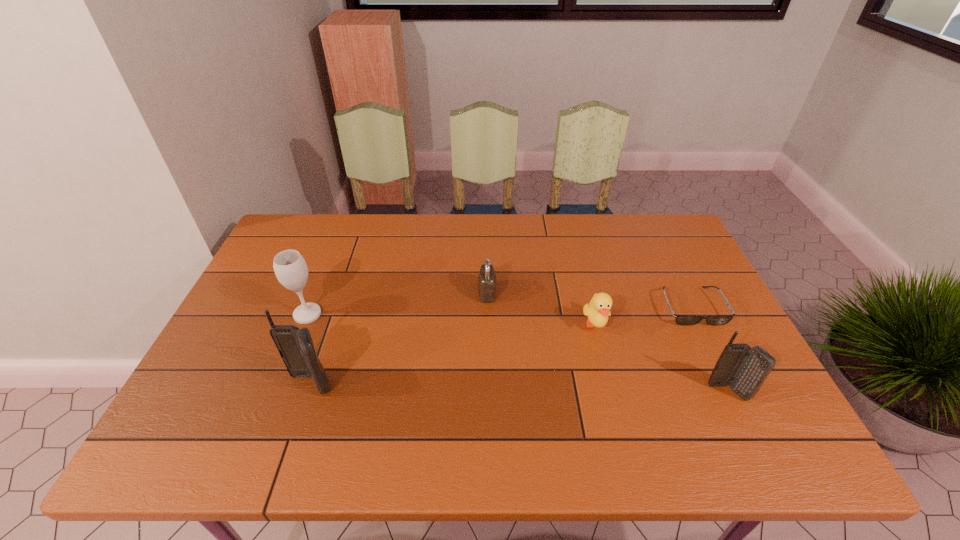
Locate an element on the screen. vacant space situated at the front of the padlock near the keyhole is located at coordinates (403, 293).

Where is `vacant space situated 0.090m on the front-facing side of the sunglasses`? vacant space situated 0.090m on the front-facing side of the sunglasses is located at coordinates (714, 354).

Where is `object located in the left edge section of the desktop`? The image size is (960, 540). object located in the left edge section of the desktop is located at coordinates 290,268.

This screenshot has width=960, height=540. I want to click on cellular telephone that is positioned at the right edge, so click(x=744, y=368).

I want to click on sunglasses that is positioned at the right edge, so click(715, 320).

Locate an element on the screen. The width and height of the screenshot is (960, 540). object situated at the near right corner is located at coordinates (744, 368).

At what (x,y) coordinates should I click in order to perform the action: click on vacant area at the far edge. Please return your answer as a coordinate pair (x, y). Image resolution: width=960 pixels, height=540 pixels. Looking at the image, I should click on (542, 240).

Where is `vacant space at the near edge`? The width and height of the screenshot is (960, 540). vacant space at the near edge is located at coordinates (x=422, y=397).

Locate an element on the screen. The height and width of the screenshot is (540, 960). vacant space at the left edge of the desktop is located at coordinates (231, 363).

This screenshot has width=960, height=540. In order to click on vacant space at the right edge in this screenshot , I will do `click(659, 281)`.